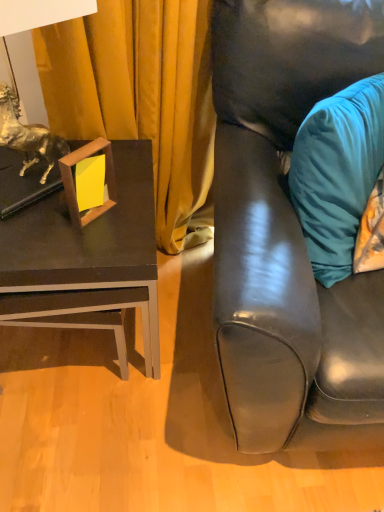
What are the coordinates of `free space behind woodenobject at left` in the screenshot? It's located at (125, 174).